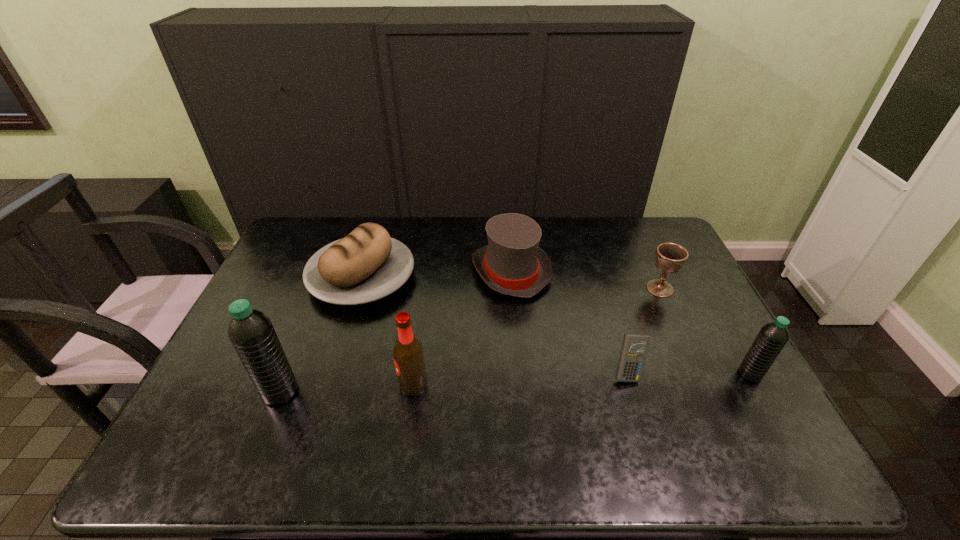
Identify the location of beer bottle. (408, 354).

The height and width of the screenshot is (540, 960). I want to click on vacant space located 0.110m on the right of the tallest object, so click(342, 392).

This screenshot has height=540, width=960. What are the coordinates of `vacant space positioned on the left of the third tallest object` in the screenshot? It's located at (612, 374).

At what (x,y) coordinates should I click in order to perform the action: click on vacant point located on the front of the chalice. Please return your answer as a coordinate pair (x, y). This screenshot has height=540, width=960. Looking at the image, I should click on (695, 367).

Where is `free space located on the front of the bread`? The height and width of the screenshot is (540, 960). free space located on the front of the bread is located at coordinates (321, 411).

Where is `vacant space situated on the right of the dress hat`? This screenshot has height=540, width=960. vacant space situated on the right of the dress hat is located at coordinates (636, 272).

Where is `free location located on the front-facing side of the shortest object`? This screenshot has width=960, height=540. free location located on the front-facing side of the shortest object is located at coordinates (640, 417).

This screenshot has height=540, width=960. What are the coordinates of `free point located on the left of the fifth object from right to left` in the screenshot? It's located at (277, 384).

Identify the location of bread that is positioned at the far edge. This screenshot has width=960, height=540. (366, 265).

Where is `dress hat that is at the far edge`? The image size is (960, 540). dress hat that is at the far edge is located at coordinates (512, 263).